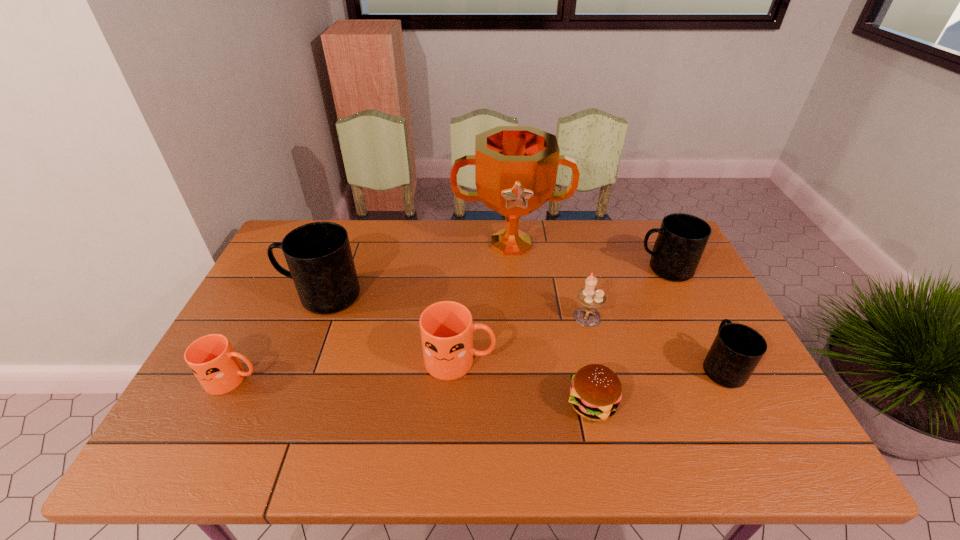
Point out which object is positioned as the nearest to the smaller orange mug. Please provide its 2D coordinates. Your answer should be formatted as a tuple, i.e. [(x, y)], where the tuple contains the x and y coordinates of a point satisfying the conditions above.

[(319, 257)]

Locate an element on the screen. the fifth closest mug to the gold award is located at coordinates (211, 358).

Choose which mug is the second nearest neighbor to the gold award. Please provide its 2D coordinates. Your answer should be formatted as a tuple, i.e. [(x, y)], where the tuple contains the x and y coordinates of a point satisfying the conditions above.

[(319, 257)]

This screenshot has height=540, width=960. What are the coordinates of `black mug that is the third closest to the brown hamburger` in the screenshot? It's located at (x=319, y=257).

Choose which black mug is the third nearest neighbor to the bigger orange mug. Please provide its 2D coordinates. Your answer should be formatted as a tuple, i.e. [(x, y)], where the tuple contains the x and y coordinates of a point satisfying the conditions above.

[(737, 349)]

Identify the location of free space that satisfies the following two spatial constraints: 1. on the side of the tallest mug with the handle; 2. on the side of the nearest black mug with the handle. (295, 367).

Where is `free point that satisfies the following two spatial constraints: 1. on the side of the award with the star emblem; 2. on the handle side of the smaller orange mug`? The width and height of the screenshot is (960, 540). free point that satisfies the following two spatial constraints: 1. on the side of the award with the star emblem; 2. on the handle side of the smaller orange mug is located at coordinates (523, 379).

Locate an element on the screen. This screenshot has height=540, width=960. vacant region that satisfies the following two spatial constraints: 1. on the handle side of the third mug from right to left; 2. on the side of the smallest black mug with the handle is located at coordinates (460, 367).

I want to click on vacant space that satisfies the following two spatial constraints: 1. on the side of the biggest black mug with the handle; 2. on the side of the smallest black mug with the handle, so coord(295,367).

Where is `vacant space that satisfies the following two spatial constraints: 1. on the side of the second smallest black mug with the handle; 2. on the side of the nearest black mug with the handle`? This screenshot has height=540, width=960. vacant space that satisfies the following two spatial constraints: 1. on the side of the second smallest black mug with the handle; 2. on the side of the nearest black mug with the handle is located at coordinates (712, 367).